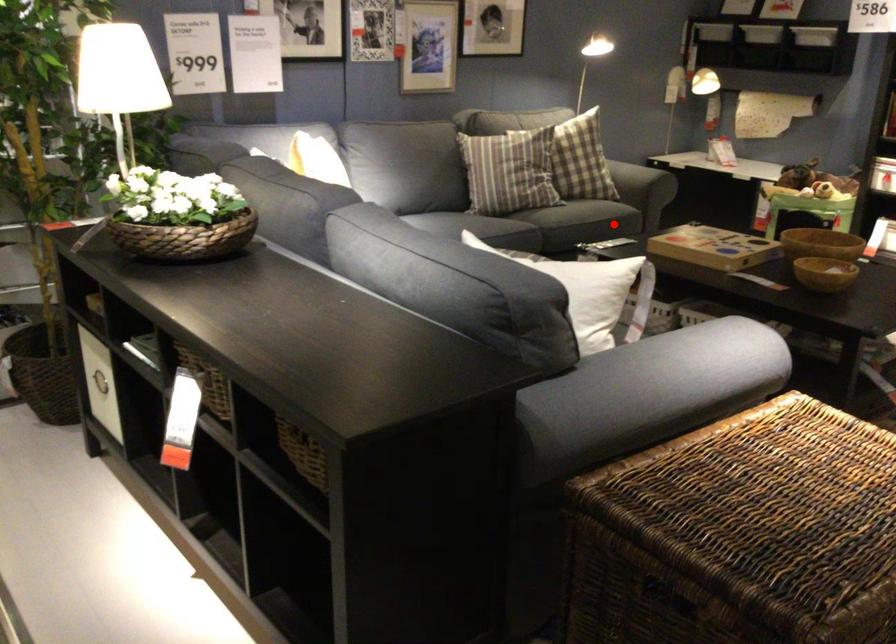
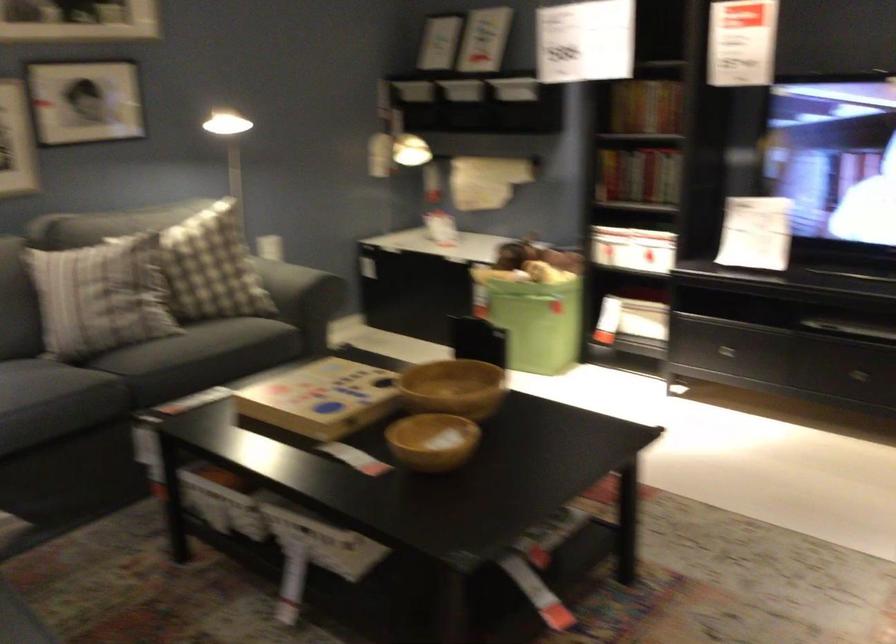
Question: I am providing you with two images of the same scene from different viewpoints. In image1, a red point is highlighted. Considering the same 3D point in image2, which of the following is correct?

Choices:
 (A) It is closer
 (B) It is farther

Answer: (A)